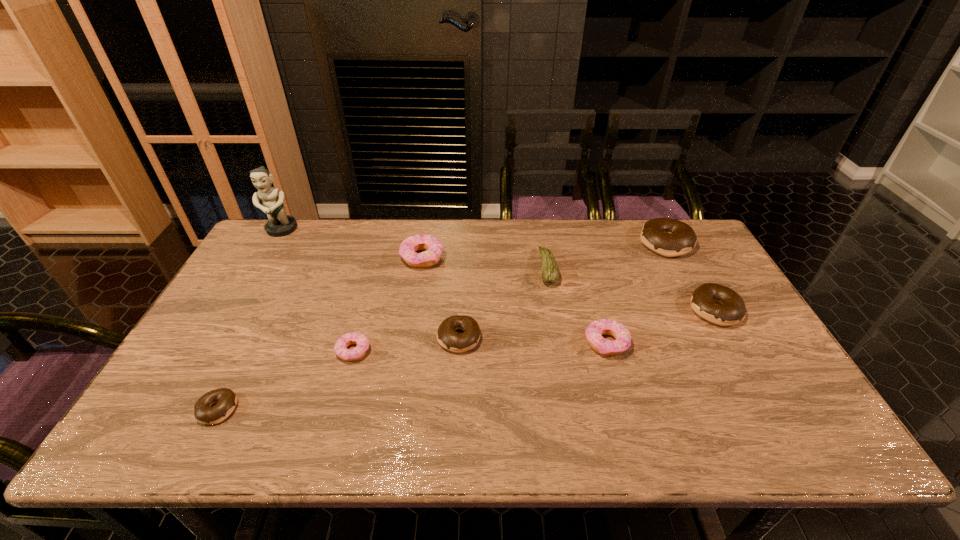
In order to click on object present at the near edge in this screenshot , I will do `click(226, 399)`.

Image resolution: width=960 pixels, height=540 pixels. Find the location of `figurine that is at the left edge`. figurine that is at the left edge is located at coordinates (279, 224).

At what (x,y) coordinates should I click in order to perform the action: click on doughnut present at the left edge. Please return your answer as a coordinate pair (x, y). The image size is (960, 540). Looking at the image, I should click on (x=226, y=399).

Locate an element on the screen. object situated at the far left corner is located at coordinates click(279, 224).

At what (x,y) coordinates should I click in order to perform the action: click on object situated at the near left corner. Please return your answer as a coordinate pair (x, y). The width and height of the screenshot is (960, 540). Looking at the image, I should click on (226, 399).

At what (x,y) coordinates should I click in order to perform the action: click on object that is at the far right corner. Please return your answer as a coordinate pair (x, y). Image resolution: width=960 pixels, height=540 pixels. Looking at the image, I should click on (668, 237).

You are a GUI agent. You are given a task and a screenshot of the screen. Output one action in this format:
    pyautogui.click(x=<x>, y=<y>)
    Task: Click on the vacant space at the far edge
    
    Given the screenshot: What is the action you would take?
    pyautogui.click(x=615, y=221)

At what (x,y) coordinates should I click in order to perform the action: click on vacant space at the near edge. Please return your answer as a coordinate pair (x, y). Looking at the image, I should click on (372, 428).

Find the location of a particular element. This screenshot has width=960, height=540. free region at the left edge of the desktop is located at coordinates (220, 364).

Locate an element on the screen. The height and width of the screenshot is (540, 960). vacant region at the far left corner is located at coordinates point(262,241).